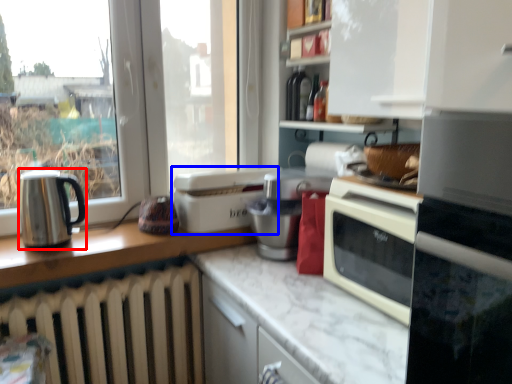
Question: Which of the following is the farthest to the observer, kitchen appliance (highlighted by a red box) or kitchen appliance (highlighted by a blue box)?

Choices:
 (A) kitchen appliance
 (B) kitchen appliance

Answer: (B)